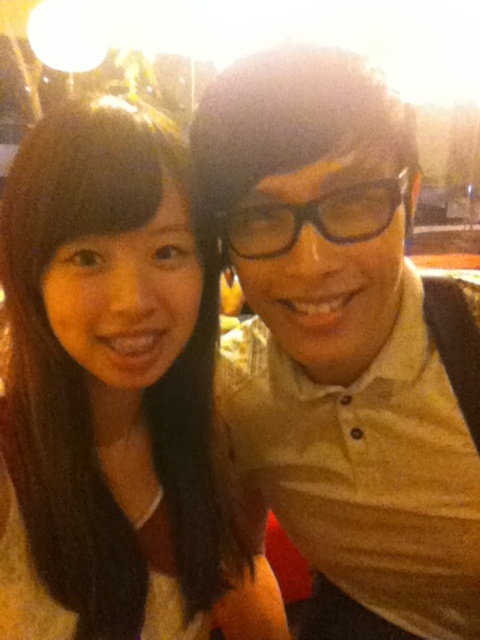
Question: Among these points, which one is nearest to the camera?

Choices:
 (A) (359, 211)
 (B) (33, 332)
 (C) (409, 266)

Answer: (A)

Question: Does matte beige polo shirt at center have a smaller size compared to black plastic glasses at center?

Choices:
 (A) no
 (B) yes

Answer: (A)

Question: Is matte beige polo shirt at center closer to camera compared to black plastic glasses at center?

Choices:
 (A) yes
 (B) no

Answer: (A)

Question: Is matte beige polo shirt at center smaller than black plastic glasses at center?

Choices:
 (A) yes
 (B) no

Answer: (B)

Question: Among these objects, which one is nearest to the camera?

Choices:
 (A) matte beige polo shirt at center
 (B) matte brown hair at left
 (C) black plastic glasses at center

Answer: (A)

Question: Estimate the real-world distances between objects in this image. Which object is closer to the black plastic glasses at center?

Choices:
 (A) matte brown hair at left
 (B) matte beige polo shirt at center

Answer: (B)